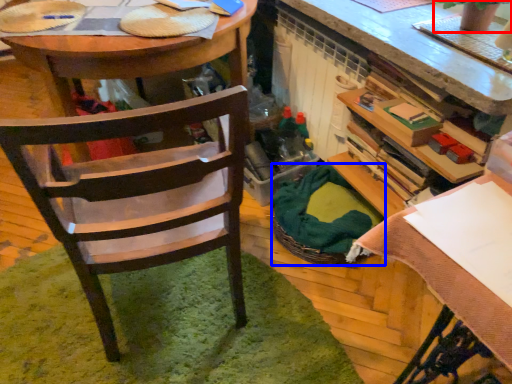
Question: Among these objects, which one is nearest to the camera, houseplant (highlighted by a red box) or picnic basket (highlighted by a blue box)?

Choices:
 (A) houseplant
 (B) picnic basket

Answer: (A)